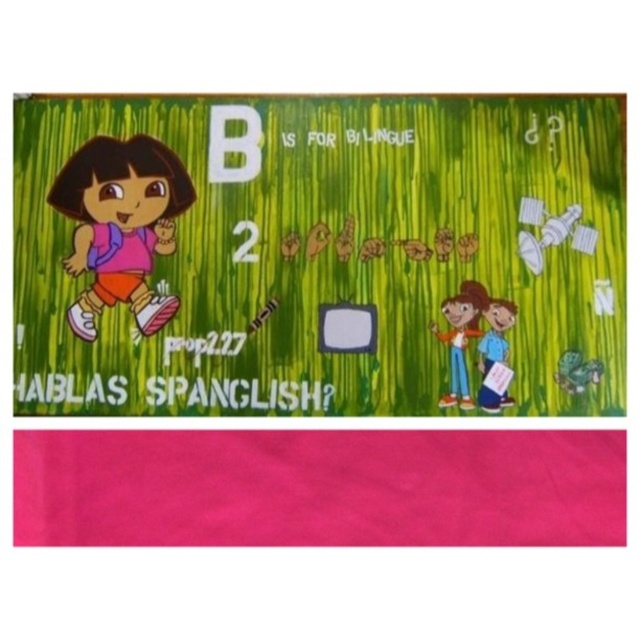
Who is positioned more to the left, matte pink shorts at left or smooth blue pants at lower right?

matte pink shorts at left

This screenshot has width=640, height=640. Find the location of `matte pink shorts at left`. matte pink shorts at left is located at coordinates (120, 225).

Does point (109, 241) come farther from viewer compared to point (449, 301)?

Yes, point (109, 241) is farther from viewer.

Locate an element on the screen. Image resolution: width=640 pixels, height=640 pixels. matte pink shorts at left is located at coordinates tap(120, 225).

Is matte pink shorts at left further to camera compared to blue fabric shirt at lower right?

Yes, matte pink shorts at left is behind blue fabric shirt at lower right.

Which is below, matte pink shorts at left or blue fabric shirt at lower right?

blue fabric shirt at lower right is lower down.

This screenshot has height=640, width=640. Describe the element at coordinates (120, 225) in the screenshot. I see `matte pink shorts at left` at that location.

Image resolution: width=640 pixels, height=640 pixels. What are the coordinates of `matte pink shorts at left` in the screenshot? It's located at (120, 225).

Does smooth blue pants at lower right appear under blue fabric shirt at lower right?

Actually, smooth blue pants at lower right is above blue fabric shirt at lower right.

Is point (476, 321) less distant than point (513, 317)?

Yes, point (476, 321) is in front of point (513, 317).

Identify the location of smooth blue pants at lower right. Image resolution: width=640 pixels, height=640 pixels. (460, 339).